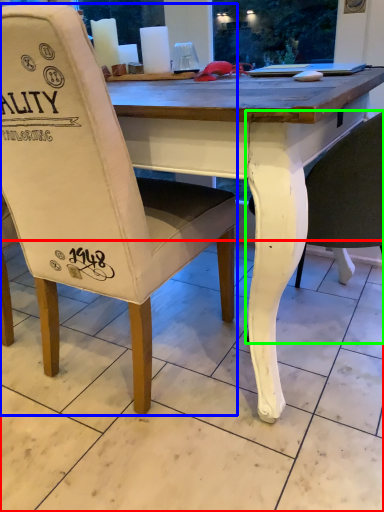
Question: Based on their relative distances, which object is farther from tile (highlighted by a red box)? Choose from chair (highlighted by a blue box) and chair (highlighted by a green box).

Choices:
 (A) chair
 (B) chair

Answer: (B)